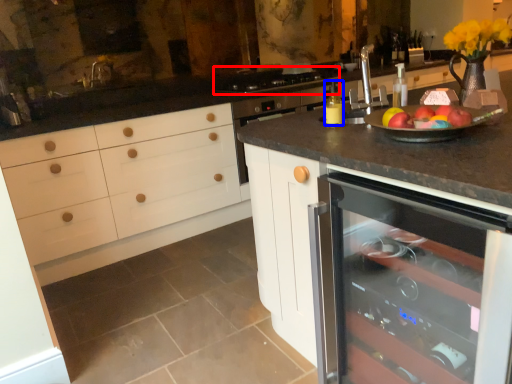
Question: Which point is further to the camera, gas stove (highlighted by a red box) or bottle (highlighted by a blue box)?

Choices:
 (A) gas stove
 (B) bottle

Answer: (A)